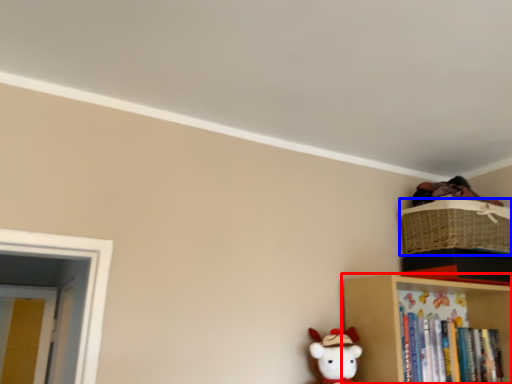
Question: Among these objects, which one is nearest to the camera, shelf (highlighted by a red box) or basket (highlighted by a blue box)?

Choices:
 (A) shelf
 (B) basket

Answer: (A)